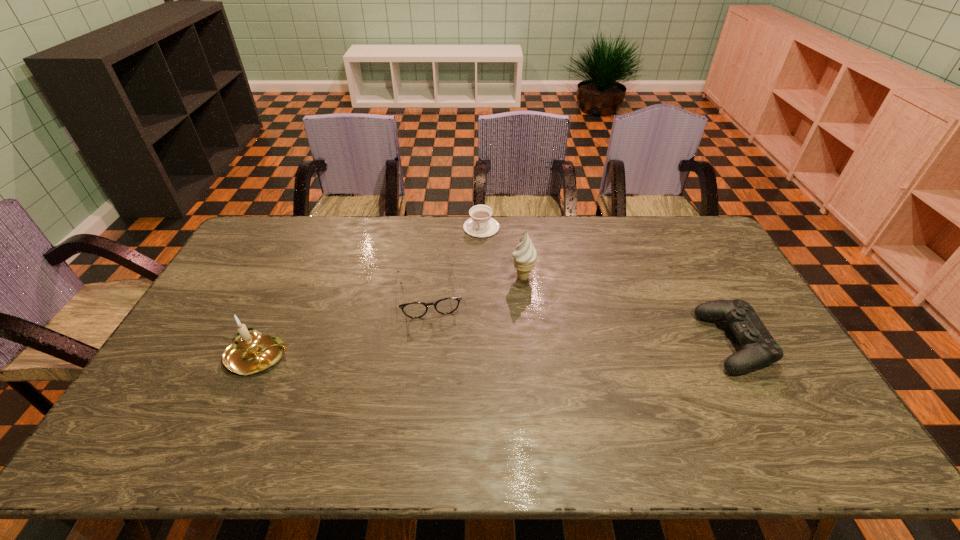
What are the coordinates of `the leftmost object` in the screenshot? It's located at (251, 352).

Where is `candle holder`? candle holder is located at coordinates (251, 352).

Identify the location of the rightmost object. The image size is (960, 540). pyautogui.click(x=759, y=349).

In order to click on control in this screenshot , I will do `click(759, 349)`.

The image size is (960, 540). I want to click on the second object from right to left, so click(x=525, y=254).

You are a GUI agent. You are given a task and a screenshot of the screen. Output one action in this format:
    pyautogui.click(x=<x>, y=<y>)
    Task: Click on the teacup
    This screenshot has width=960, height=540.
    Given the screenshot: What is the action you would take?
    pyautogui.click(x=481, y=225)

This screenshot has width=960, height=540. I want to click on spectacles, so click(448, 305).

Identify the location of vacant space located on the handle side of the candle holder. (372, 356).

Where is `vacant region located 0.360m on the back of the third tallest object`? vacant region located 0.360m on the back of the third tallest object is located at coordinates (678, 240).

Identify the location of free region located on the front-facing side of the fourth object from left to right. Image resolution: width=960 pixels, height=540 pixels. pyautogui.click(x=473, y=323).